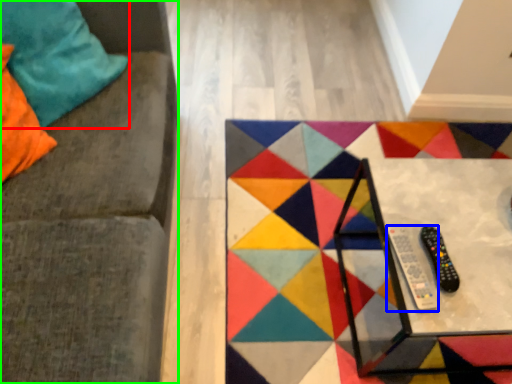
Question: Which is farther away from pillow (highlighted by a red box)? remote (highlighted by a blue box) or furniture (highlighted by a green box)?

Choices:
 (A) remote
 (B) furniture

Answer: (A)